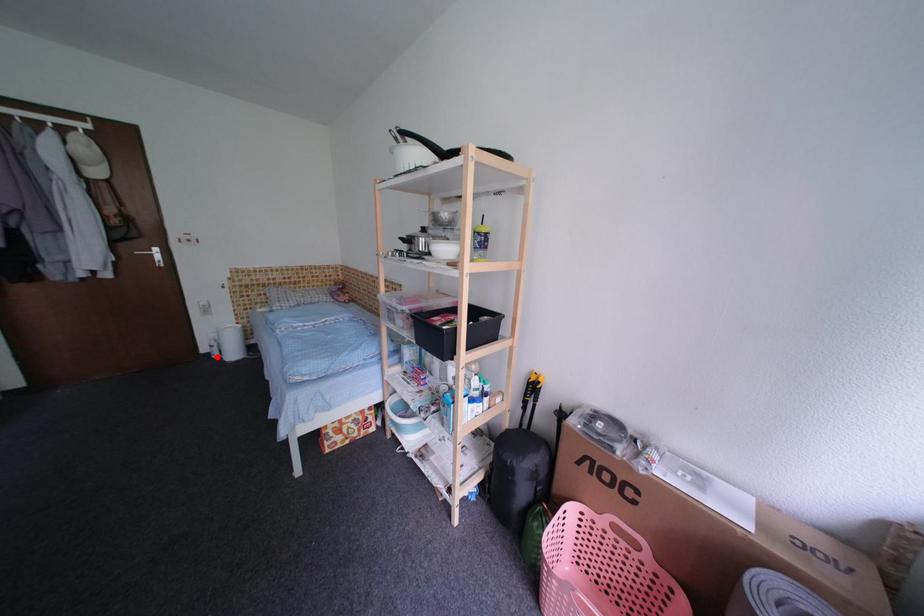
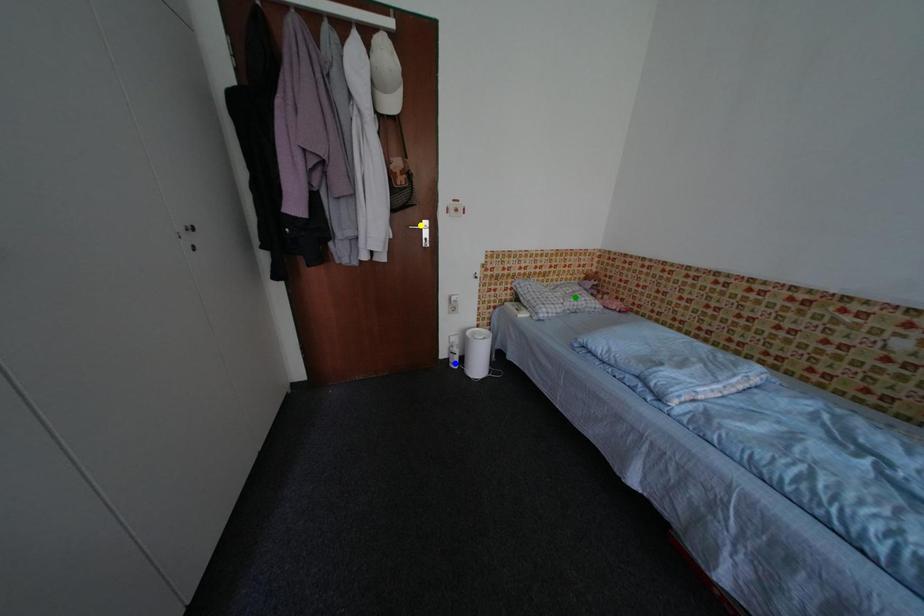
Question: I am providing you with two images of the same scene from different viewpoints. A red point is marked on the first image. You are given multiple points on the second image. Which point in image 2 represents the same 3d spot as the red point in image 1?

Choices:
 (A) blue point
 (B) green point
 (C) yellow point

Answer: (A)